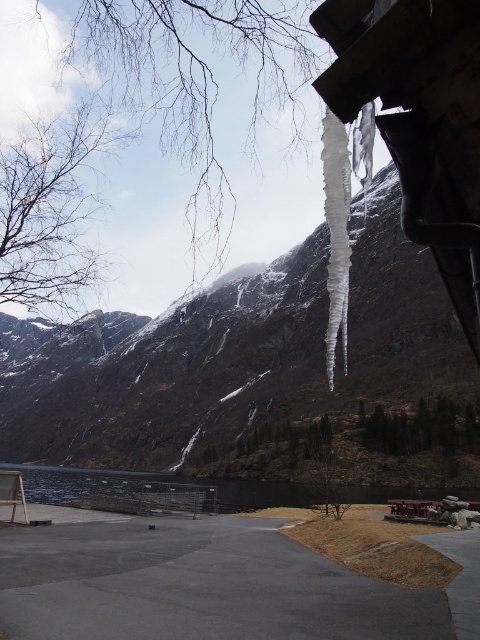
Question: Can you confirm if snowy rock mountain at upper center is wider than dark reflective water at center?

Choices:
 (A) no
 (B) yes

Answer: (B)

Question: Does snowy rock mountain at upper center have a smaller size compared to dark reflective water at center?

Choices:
 (A) no
 (B) yes

Answer: (A)

Question: Does snowy rock mountain at upper center appear on the left side of dark reflective water at center?

Choices:
 (A) yes
 (B) no

Answer: (A)

Question: Which point is farther to the camera?

Choices:
 (A) snowy rock mountain at upper center
 (B) dark reflective water at center

Answer: (B)

Question: Among these objects, which one is farthest from the camera?

Choices:
 (A) dark reflective water at center
 (B) snowy rock mountain at upper center

Answer: (A)